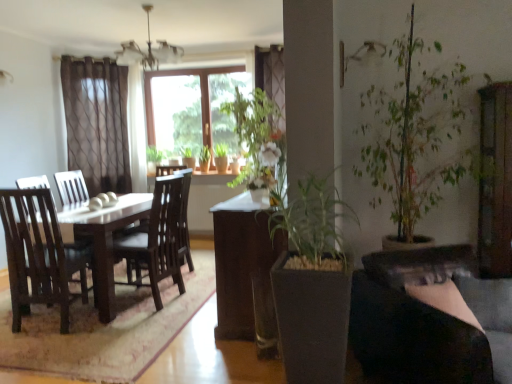
Find the location of a particular element. The image size is (512, 384). green leafy plant at center, the 2th houseplant viewed from the right is located at coordinates (221, 157).

Image resolution: width=512 pixels, height=384 pixels. What do you see at coordinates (245, 270) in the screenshot? I see `brown wooden table at center` at bounding box center [245, 270].

What are the coordinates of `green leafy plant at center, positioned as the 1th houseplant in back-to-front order` in the screenshot? It's located at (221, 157).

Is the depth of green leafy plant at center, the 2th houseplant viewed from the right, greater than that of green matte plant at center, placed as the first houseplant when sorted from bottom to top?

Yes, green leafy plant at center, the 2th houseplant viewed from the right, is further from the camera.

How different are the orientations of green leafy plant at center, acting as the 2th houseplant starting from the front, and green matte plant at center, positioned as the second houseplant in left-to-right order, in degrees?

The angular difference between green leafy plant at center, acting as the 2th houseplant starting from the front, and green matte plant at center, positioned as the second houseplant in left-to-right order, is 0.277 degrees.

Based on the photo, is green matte plant at center, the second houseplant when ordered from back to front, a part of green leafy plant at center, arranged as the second houseplant when ordered from the bottom?

No, green matte plant at center, the second houseplant when ordered from back to front, is not a part of green leafy plant at center, arranged as the second houseplant when ordered from the bottom.

Image resolution: width=512 pixels, height=384 pixels. I want to click on houseplant below the green leafy plant at center, arranged as the second houseplant when ordered from the bottom (from the image's perspective), so click(312, 284).

Between brown wooden table at center and green matte plant at center, positioned as the second houseplant in left-to-right order, which one has smaller size?

Smaller between the two is green matte plant at center, positioned as the second houseplant in left-to-right order.

Does brown wooden table at center come in front of green matte plant at center, acting as the 2th houseplant starting from the top?

That is False.

From a real-world perspective, is brown wooden table at center located beneath green matte plant at center, acting as the 2th houseplant starting from the top?

Yes, from a real-world perspective, brown wooden table at center is under green matte plant at center, acting as the 2th houseplant starting from the top.

Would you say brown wooden table at center is a long distance from green matte plant at center, acting as the 2th houseplant starting from the top?

They are positioned close to each other.

What's the angular difference between brown wooden table at center and green leafy plant at center, acting as the 2th houseplant starting from the front,'s facing directions?

There is a 89.4-degree angle between the facing directions of brown wooden table at center and green leafy plant at center, acting as the 2th houseplant starting from the front.

From the picture: Which is correct: brown wooden table at center is inside green leafy plant at center, which appears as the first houseplant when viewed from the top, or outside of it?

brown wooden table at center is spatially situated outside green leafy plant at center, which appears as the first houseplant when viewed from the top.

From a real-world perspective, which is physically below, brown wooden table at center or green leafy plant at center, arranged as the second houseplant when ordered from the bottom?

In real-world perspective, brown wooden table at center is lower.

Does brown wooden table at center have a lesser width compared to green leafy plant at center, positioned as the 1th houseplant in back-to-front order?

Incorrect, the width of brown wooden table at center is not less than that of green leafy plant at center, positioned as the 1th houseplant in back-to-front order.

From a real-world perspective, is green matte plant at center, the first houseplant viewed from the right, physically located above or below green leafy plant at center, arranged as the second houseplant when ordered from the bottom?

In terms of real-world spatial position, green matte plant at center, the first houseplant viewed from the right, is below green leafy plant at center, arranged as the second houseplant when ordered from the bottom.

I want to click on houseplant that appears below the green leafy plant at center, the 2th houseplant viewed from the right (from a real-world perspective), so click(x=312, y=284).

How much distance is there between green matte plant at center, which is the first houseplant in front-to-back order, and green leafy plant at center, arranged as the second houseplant when ordered from the bottom?

green matte plant at center, which is the first houseplant in front-to-back order, and green leafy plant at center, arranged as the second houseplant when ordered from the bottom, are 3.85 meters apart.

From the image's perspective, is green matte plant at center, the first houseplant viewed from the right, located beneath green leafy plant at center, acting as the 2th houseplant starting from the front?

Correct, green matte plant at center, the first houseplant viewed from the right, appears lower than green leafy plant at center, acting as the 2th houseplant starting from the front, in the image.

Would you say green leafy plant at center, acting as the 2th houseplant starting from the front, is outside brown wooden table at center?

Yes, green leafy plant at center, acting as the 2th houseplant starting from the front, is outside of brown wooden table at center.

Can you confirm if green leafy plant at center, positioned as the 1th houseplant in back-to-front order, is smaller than brown wooden table at center?

Indeed, green leafy plant at center, positioned as the 1th houseplant in back-to-front order, has a smaller size compared to brown wooden table at center.

Is point (223, 162) closer to viewer compared to point (239, 339)?

That is False.

Looking at this image, can you tell me how much green matte plant at center, which is the first houseplant in front-to-back order, and brown wooden table at center differ in facing direction?

green matte plant at center, which is the first houseplant in front-to-back order, and brown wooden table at center are facing 89.1 degrees away from each other.

Is green matte plant at center, acting as the 2th houseplant starting from the top, not near brown wooden table at center?

No, there isn't a large distance between green matte plant at center, acting as the 2th houseplant starting from the top, and brown wooden table at center.

From the picture: Is green matte plant at center, positioned as the second houseplant in left-to-right order, taller than brown wooden table at center?

Yes, green matte plant at center, positioned as the second houseplant in left-to-right order, is taller than brown wooden table at center.

From the image's perspective, is green matte plant at center, the first houseplant viewed from the right, positioned above or below brown wooden table at center?

Clearly, from the image's perspective, green matte plant at center, the first houseplant viewed from the right, is below brown wooden table at center.

Locate an element on the screen. houseplant on the left of the green matte plant at center, positioned as the second houseplant in left-to-right order is located at coordinates (221, 157).

Locate an element on the screen. This screenshot has width=512, height=384. table behind the green matte plant at center, positioned as the second houseplant in left-to-right order is located at coordinates (245, 270).

Estimate the real-world distances between objects in this image. Which object is further from brown wooden table at center, green matte plant at center, which is the first houseplant in front-to-back order, or green leafy plant at center, arranged as the second houseplant when ordered from the bottom?

green leafy plant at center, arranged as the second houseplant when ordered from the bottom, lies further to brown wooden table at center than the other object.

From the image, which object appears to be farther from green matte plant at center, acting as the 2th houseplant starting from the top, brown wooden table at center or green leafy plant at center, acting as the 2th houseplant starting from the front?

The object further to green matte plant at center, acting as the 2th houseplant starting from the top, is green leafy plant at center, acting as the 2th houseplant starting from the front.

Which object lies nearer to the anchor point brown wooden table at center, green leafy plant at center, which appears as the first houseplant when viewed from the top, or green matte plant at center, acting as the 2th houseplant starting from the top?

Based on the image, green matte plant at center, acting as the 2th houseplant starting from the top, appears to be nearer to brown wooden table at center.

When comparing their distances from green leafy plant at center, arranged as the second houseplant when ordered from the bottom, does green matte plant at center, the first houseplant viewed from the right, or brown wooden table at center seem further?

green matte plant at center, the first houseplant viewed from the right.

Looking at the image, which one is located further to green matte plant at center, which is the first houseplant in front-to-back order, green leafy plant at center, the 2th houseplant viewed from the right, or brown wooden table at center?

green leafy plant at center, the 2th houseplant viewed from the right, lies further to green matte plant at center, which is the first houseplant in front-to-back order, than the other object.

Looking at the image, which one is located closer to green leafy plant at center, acting as the 2th houseplant starting from the front, brown wooden table at center or green matte plant at center, which is the first houseplant in front-to-back order?

brown wooden table at center lies closer to green leafy plant at center, acting as the 2th houseplant starting from the front, than the other object.

What are the coordinates of `table between green matte plant at center, acting as the 2th houseplant starting from the top, and green leafy plant at center, positioned as the 1th houseplant in back-to-front order, in the front-back direction` in the screenshot? It's located at (245, 270).